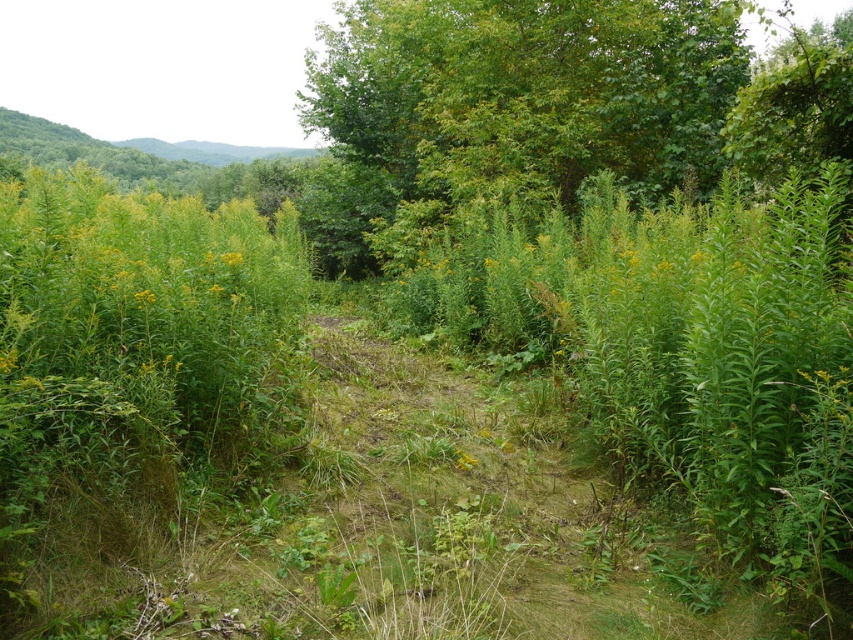
Between green leafy tree at upper center and yellow matte flower at center-left, which one is positioned lower?

Positioned lower is yellow matte flower at center-left.

Which is more to the right, green leafy tree at upper center or yellow matte flower at center-left?

yellow matte flower at center-left is more to the right.

Looking at this image, who is more forward, (431, 211) or (142, 300)?

Point (142, 300) is more forward.

You are a GUI agent. You are given a task and a screenshot of the screen. Output one action in this format:
    pyautogui.click(x=<x>, y=<y>)
    Task: Click on the green leafy tree at upper center
    This screenshot has height=640, width=853.
    Given the screenshot: What is the action you would take?
    pyautogui.click(x=509, y=106)

Between yellow matte flower at center and yellow matte flower at center-left, which one is positioned higher?

Positioned higher is yellow matte flower at center-left.

Who is shorter, yellow matte flower at center or yellow matte flower at center-left?

yellow matte flower at center

Find the location of `yellow matte flower at center`. yellow matte flower at center is located at coordinates click(x=463, y=460).

Which is behind, point (465, 454) or point (229, 260)?

Point (229, 260)

Can you confirm if yellow matte flower at center is shorter than yellow-green leafy plant at center?

Indeed, yellow matte flower at center has a lesser height compared to yellow-green leafy plant at center.

The height and width of the screenshot is (640, 853). What do you see at coordinates (463, 460) in the screenshot?
I see `yellow matte flower at center` at bounding box center [463, 460].

Locate an element on the screen. The image size is (853, 640). yellow matte flower at center is located at coordinates (463, 460).